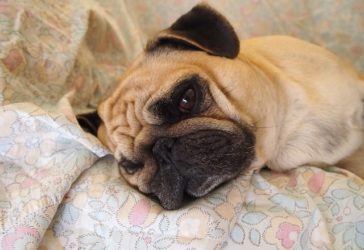
The width and height of the screenshot is (364, 250). What are the coordinates of `blanket` in the screenshot? It's located at tap(60, 203).